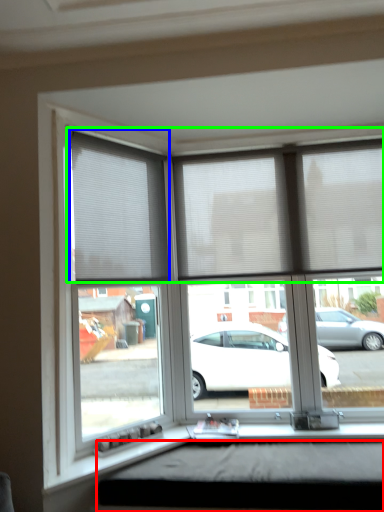
Question: Which is nearer to the window box (highlighted by a red box)? window blind (highlighted by a blue box) or blind (highlighted by a green box).

Choices:
 (A) window blind
 (B) blind

Answer: (B)